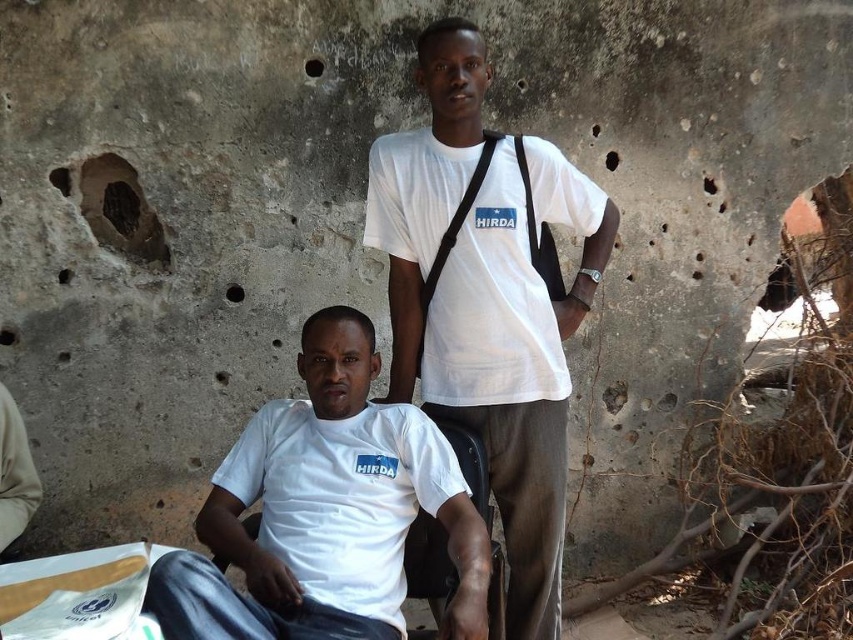
You are standing in front of the image and want to know how far the point at coordinates (503, 294) is from you. Can you determine the distance?

The point at coordinates (503, 294) is 9.17 feet away from the camera, so it is 9.17 feet away from you.